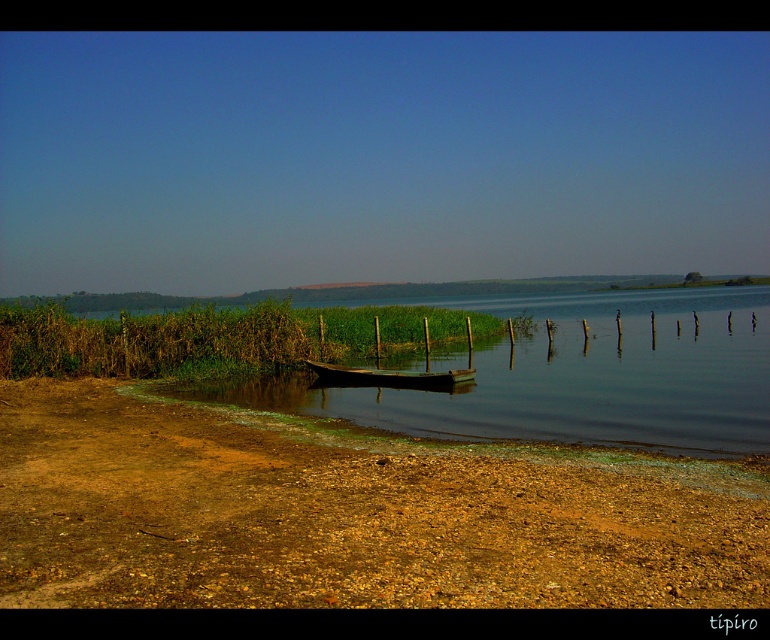
In the scene shown: You are standing on the brown gravel shore at lower left and want to reach the wooden boat at center. Which direction should you move to get closer to the boat?

Since the brown gravel shore at lower left is in front of the wooden boat at center, you should move backward to reach the boat.

You are a photographer planning to capture the entire scene in one shot. Given that the brown gravel shore at lower left and the wooden boat at center must both be visible, which object will occupy more space in your photo?

The brown gravel shore at lower left will occupy more space in the photo because it is larger in size than the wooden boat at center according to the description.